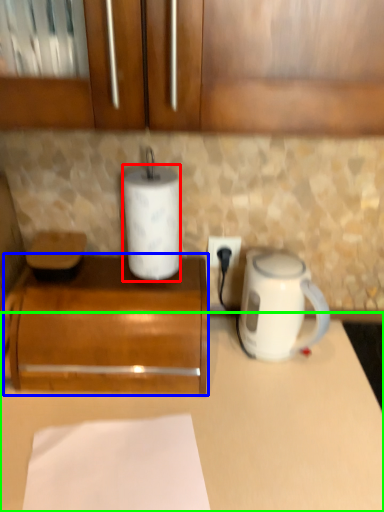
Question: Which is farther away from paper towel (highlighted by a red box)? cabinetry (highlighted by a blue box) or counter (highlighted by a green box)?

Choices:
 (A) cabinetry
 (B) counter

Answer: (B)